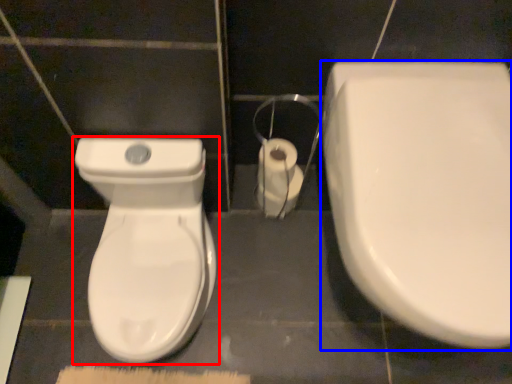
Question: Among these objects, which one is farthest to the camera, toilet (highlighted by a red box) or toilet (highlighted by a blue box)?

Choices:
 (A) toilet
 (B) toilet

Answer: (A)